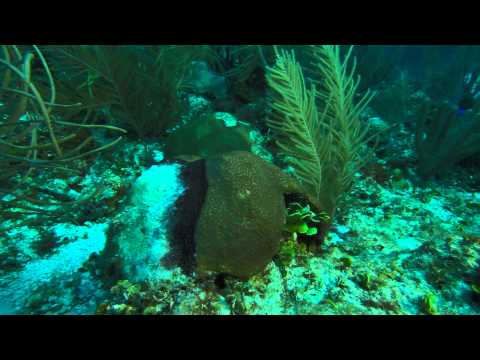
At what (x,y) coordinates should I click in order to perform the action: click on bareleaf plant. Please return your answer as a coordinate pair (x, y). The width and height of the screenshot is (480, 360). Looking at the image, I should click on (20, 80), (18, 122), (50, 124), (84, 131), (59, 175), (25, 152), (50, 91).